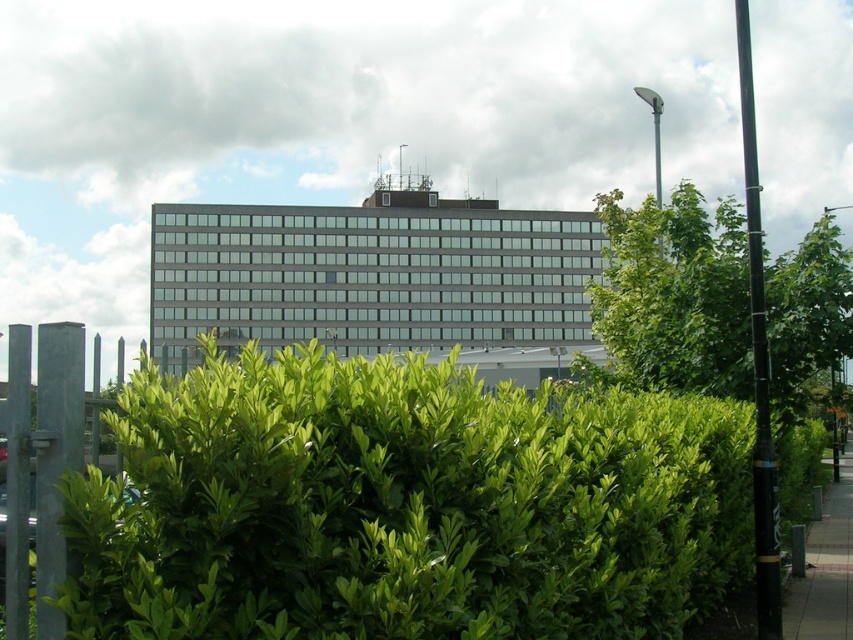
You are a landscape architect designing a pathway between the green leafy hedge at left and the green leafy tree at right. The pathway must be 2 meters wide. Is there enough space between them to accommodate the pathway?

The green leafy hedge at left and green leafy tree at right are 2.31 meters apart from each other. Since the required pathway width is 2 meters, the distance between them is sufficient to accommodate the pathway.